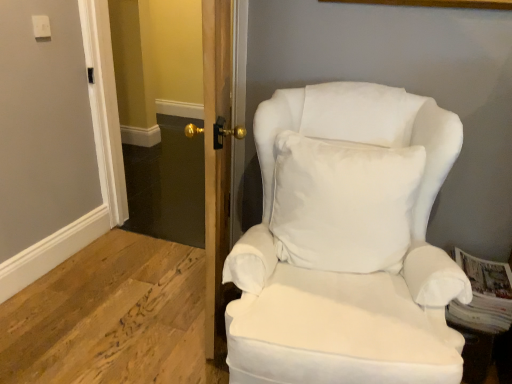
Identify the location of wooden door at center. (217, 162).

Where is `white fabric chair at right`? The image size is (512, 384). white fabric chair at right is located at coordinates (347, 242).

Image resolution: width=512 pixels, height=384 pixels. What do you see at coordinates (161, 115) in the screenshot?
I see `clear glass door at center` at bounding box center [161, 115].

Where is `wooden door at center`? Image resolution: width=512 pixels, height=384 pixels. wooden door at center is located at coordinates (217, 162).

Considering the relative positions of wooden door at center and white fabric chair at right in the image provided, is wooden door at center to the right of white fabric chair at right from the viewer's perspective?

In fact, wooden door at center is to the left of white fabric chair at right.

Considering the relative sizes of wooden door at center and white fabric chair at right in the image provided, is wooden door at center thinner than white fabric chair at right?

Yes, wooden door at center is thinner than white fabric chair at right.

From the image's perspective, would you say wooden door at center is positioned over white fabric chair at right?

Yes, from the image's perspective, wooden door at center is over white fabric chair at right.

Would you say white fabric chair at right is a long distance from white soft cushion at center?

No, white fabric chair at right is in close proximity to white soft cushion at center.

Relative to white soft cushion at center, is white fabric chair at right in front or behind?

In the image, white fabric chair at right appears in front of white soft cushion at center.

Which point is more forward, (232, 276) or (306, 172)?

The point (232, 276) is closer.

Considering the sizes of objects wooden door at center and clear glass door at center in the image provided, who is wider, wooden door at center or clear glass door at center?

With larger width is wooden door at center.

From a real-world perspective, who is located lower, wooden door at center or clear glass door at center?

clear glass door at center, from a real-world perspective.

Considering the sizes of objects wooden door at center and clear glass door at center in the image provided, who is taller, wooden door at center or clear glass door at center?

Standing taller between the two is clear glass door at center.

How much distance is there between wooden door at center and clear glass door at center?

They are 5.96 feet apart.

Does white soft cushion at center have a smaller size compared to white fabric chair at right?

Indeed, white soft cushion at center has a smaller size compared to white fabric chair at right.

Is white soft cushion at center not within white fabric chair at right?

No.

Is the depth of white soft cushion at center greater than that of white fabric chair at right?

Yes, the depth of white soft cushion at center is greater than that of white fabric chair at right.

Based on the photo, is the surface of white soft cushion at center in direct contact with white fabric chair at right?

Yes.

Between white soft cushion at center and wooden door at center, which one has more height?

With more height is wooden door at center.

The image size is (512, 384). In order to click on door that appears above the white soft cushion at center (from the image's perspective) in this screenshot , I will do `click(217, 162)`.

Is white soft cushion at center thinner than wooden door at center?

Incorrect, the width of white soft cushion at center is not less than that of wooden door at center.

Is clear glass door at center facing towards white soft cushion at center?

No, clear glass door at center is not aimed at white soft cushion at center.

Who is smaller, clear glass door at center or white soft cushion at center?

Smaller between the two is white soft cushion at center.

From the image's perspective, does clear glass door at center appear higher than white soft cushion at center?

Correct, clear glass door at center appears higher than white soft cushion at center in the image.

Does point (182, 111) appear closer or farther from the camera than point (310, 168)?

Point (182, 111).

From the picture: Which is more to the right, white soft cushion at center or clear glass door at center?

white soft cushion at center.

Does white soft cushion at center have a greater height compared to clear glass door at center?

No.

Is white soft cushion at center oriented away from clear glass door at center?

No, white soft cushion at center is not facing away from clear glass door at center.

From a real-world perspective, is white soft cushion at center on clear glass door at center?

Yes, from a real-world perspective, white soft cushion at center is above clear glass door at center.

Locate an element on the screen. Image resolution: width=512 pixels, height=384 pixels. door behind the white fabric chair at right is located at coordinates (217, 162).

The width and height of the screenshot is (512, 384). I want to click on pillow on the left of white fabric chair at right, so click(343, 203).

From the picture: From the image, which object appears to be nearer to white fabric chair at right, white soft cushion at center or wooden door at center?

Among the two, white soft cushion at center is located nearer to white fabric chair at right.

From the image, which object appears to be nearer to clear glass door at center, wooden door at center or white soft cushion at center?

white soft cushion at center lies closer to clear glass door at center than the other object.

Looking at the image, which one is located further to white fabric chair at right, white soft cushion at center or clear glass door at center?

The object further to white fabric chair at right is clear glass door at center.

Based on their spatial positions, is wooden door at center or white fabric chair at right further from clear glass door at center?

Among the two, wooden door at center is located further to clear glass door at center.

Looking at this image, which object lies further to the anchor point wooden door at center, clear glass door at center or white soft cushion at center?

clear glass door at center is positioned further to the anchor wooden door at center.

Considering their positions, is white fabric chair at right positioned further to white soft cushion at center than clear glass door at center?

clear glass door at center.

Looking at the image, which one is located further to white soft cushion at center, clear glass door at center or wooden door at center?

The object further to white soft cushion at center is clear glass door at center.

When comparing their distances from white soft cushion at center, does clear glass door at center or white fabric chair at right seem further?

The object further to white soft cushion at center is clear glass door at center.

Where is `pillow situated between wooden door at center and white fabric chair at right from left to right`? pillow situated between wooden door at center and white fabric chair at right from left to right is located at coordinates (343, 203).

Find the location of a particular element. Image resolution: width=512 pixels, height=384 pixels. door between white fabric chair at right and clear glass door at center in the front-back direction is located at coordinates (217, 162).

In order to click on pillow positioned between white fabric chair at right and clear glass door at center from near to far in this screenshot , I will do `click(343, 203)`.

You are a GUI agent. You are given a task and a screenshot of the screen. Output one action in this format:
    pyautogui.click(x=<x>, y=<y>)
    Task: Click on the door situated between clear glass door at center and white soft cushion at center from left to right
    
    Given the screenshot: What is the action you would take?
    pyautogui.click(x=217, y=162)